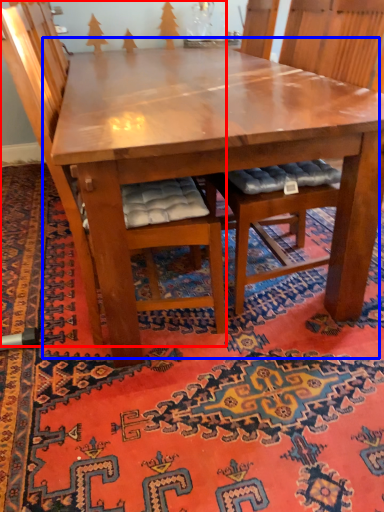
Question: Which object is closer to the camera taking this photo, chair (highlighted by a red box) or table (highlighted by a blue box)?

Choices:
 (A) chair
 (B) table

Answer: (A)